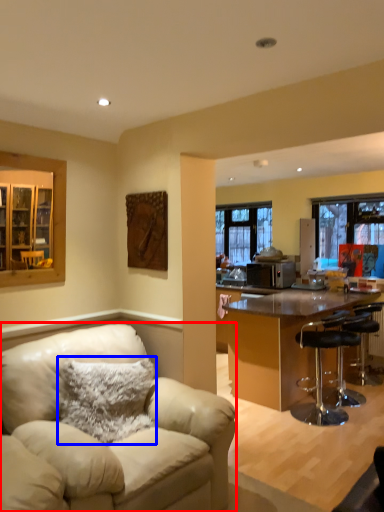
Question: Which of the following is the closest to the observer, chair (highlighted by a red box) or pillow (highlighted by a blue box)?

Choices:
 (A) chair
 (B) pillow

Answer: (A)